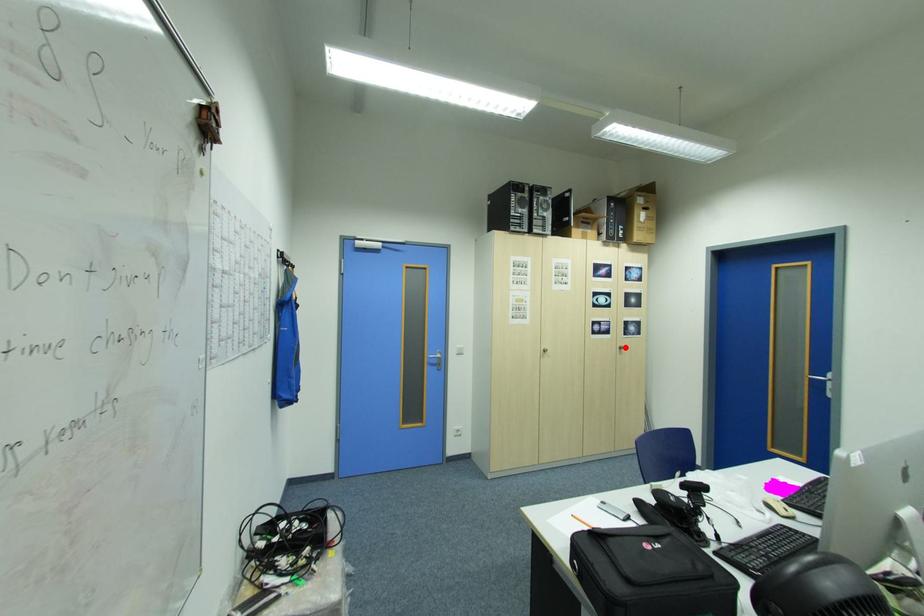
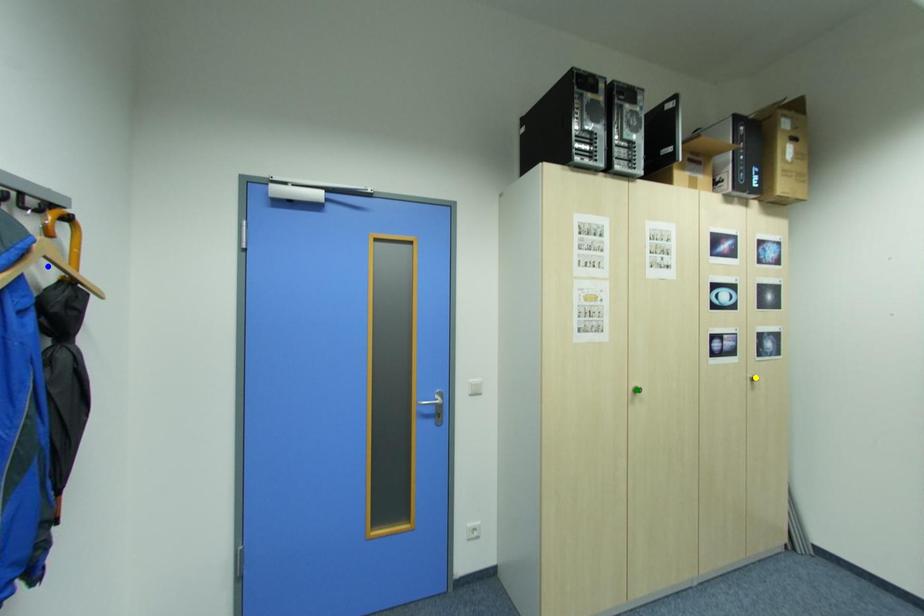
Question: I am providing you with two images of the same scene from different viewpoints. A red point is marked on the first image. You are given multiple points on the second image. In image 2, which mark is for the same physical point as the one in image 1?

Choices:
 (A) green point
 (B) blue point
 (C) yellow point

Answer: (C)